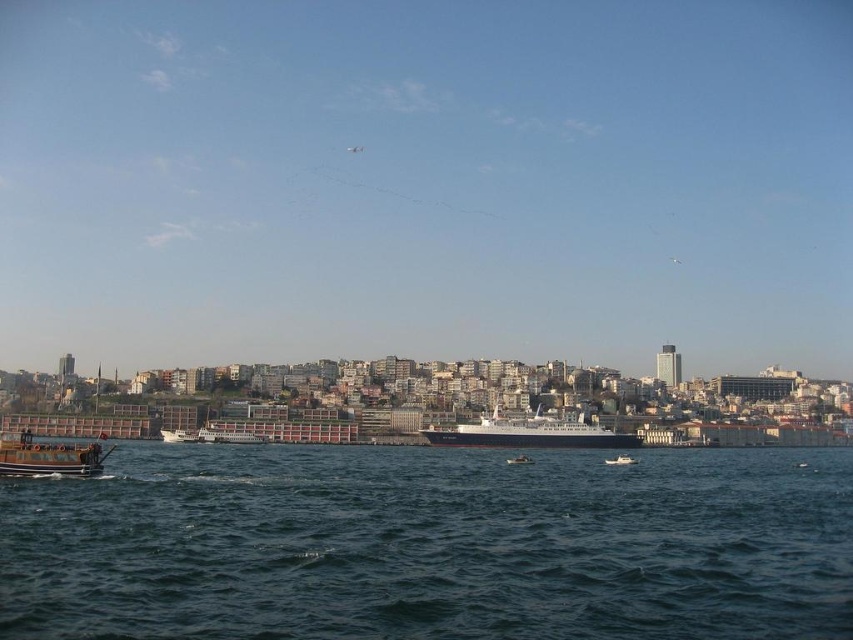
Question: Observing the image, what is the correct spatial positioning of wooden boat at lower left in reference to white matte boat at lower center?

Choices:
 (A) right
 (B) left

Answer: (B)

Question: Which object is closer to the camera taking this photo?

Choices:
 (A) white matte boat at center
 (B) dark blue water at lower center
 (C) white plastic boat at center
 (D) white glossy ship at center

Answer: (B)

Question: Can you confirm if wooden boat at lower left is wider than white matte boat at lower center?

Choices:
 (A) yes
 (B) no

Answer: (A)

Question: Does dark blue water at lower center come behind white plastic boat at center?

Choices:
 (A) yes
 (B) no

Answer: (B)

Question: Which is nearer to the white plastic boat at center?

Choices:
 (A) white glossy ship at center
 (B) dark blue water at lower center
 (C) white matte boat at lower center
 (D) white matte boat at center

Answer: (C)

Question: Which point appears farthest from the camera in this image?

Choices:
 (A) (631, 461)
 (B) (193, 436)

Answer: (B)